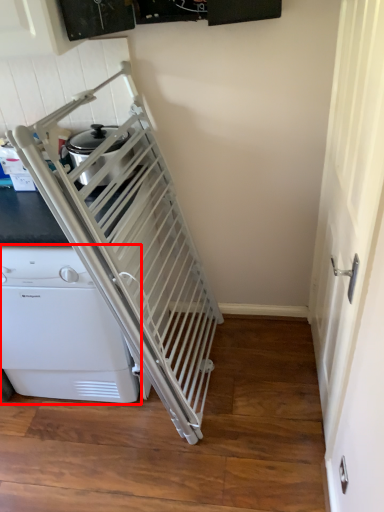
Question: Considering the relative positions of home appliance (annotated by the red box) and screen door in the image provided, where is home appliance (annotated by the red box) located with respect to the staircase?

Choices:
 (A) right
 (B) left

Answer: (B)